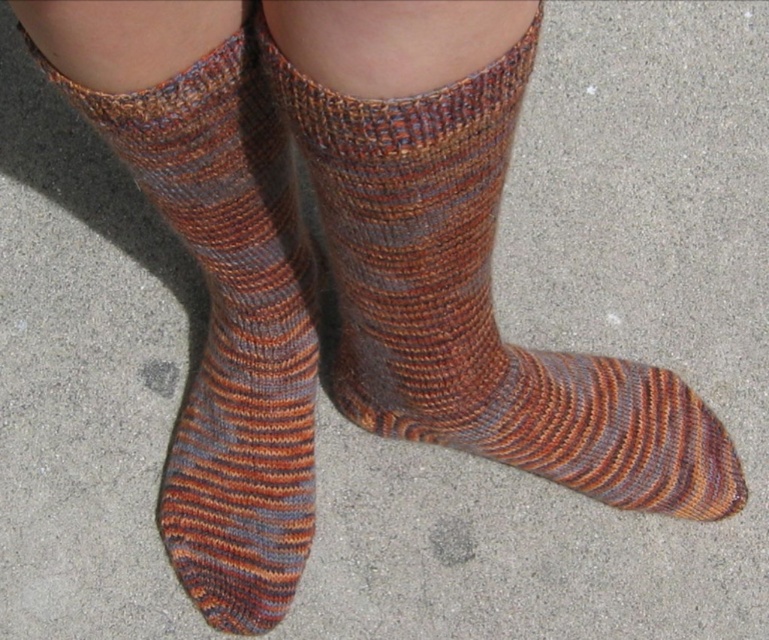
Question: Which point is closer to the camera?

Choices:
 (A) multicolored knitted sock at center
 (B) striped wool sock at center

Answer: (B)

Question: Can you confirm if striped wool sock at center is wider than multicolored knitted sock at center?

Choices:
 (A) yes
 (B) no

Answer: (A)

Question: Does striped wool sock at center have a greater width compared to multicolored knitted sock at center?

Choices:
 (A) yes
 (B) no

Answer: (A)

Question: Which point is closer to the camera?

Choices:
 (A) (308, 390)
 (B) (463, 106)

Answer: (B)

Question: From the image, what is the correct spatial relationship of striped wool sock at center in relation to multicolored knitted sock at center?

Choices:
 (A) right
 (B) left

Answer: (A)